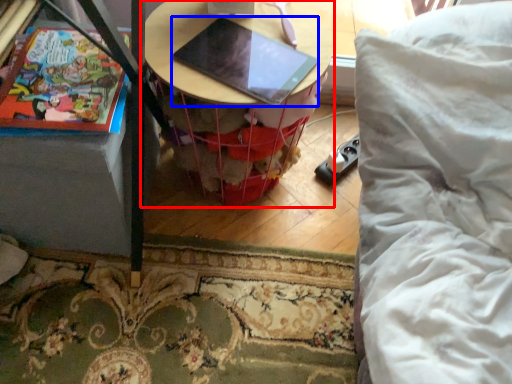
Question: Which point is further to the camera, table (highlighted by a red box) or laptop (highlighted by a blue box)?

Choices:
 (A) table
 (B) laptop

Answer: (A)